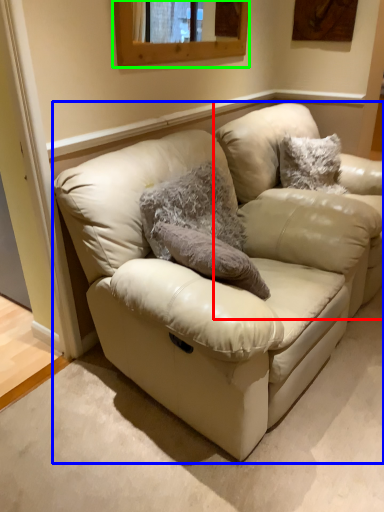
Question: Estimate the real-world distances between objects in this image. Which object is farther from swivel chair (highlighted by a red box), studio couch (highlighted by a blue box) or window (highlighted by a green box)?

Choices:
 (A) studio couch
 (B) window

Answer: (A)